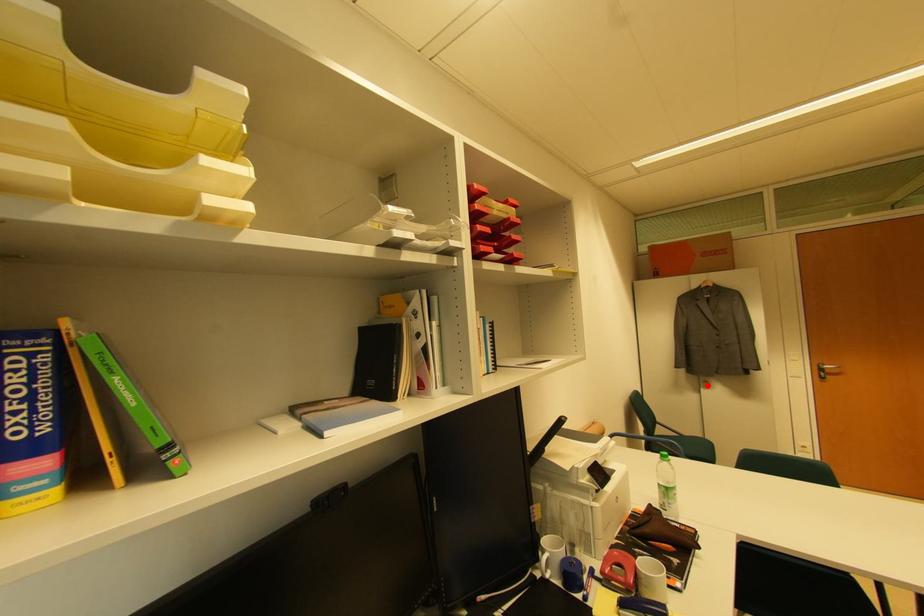
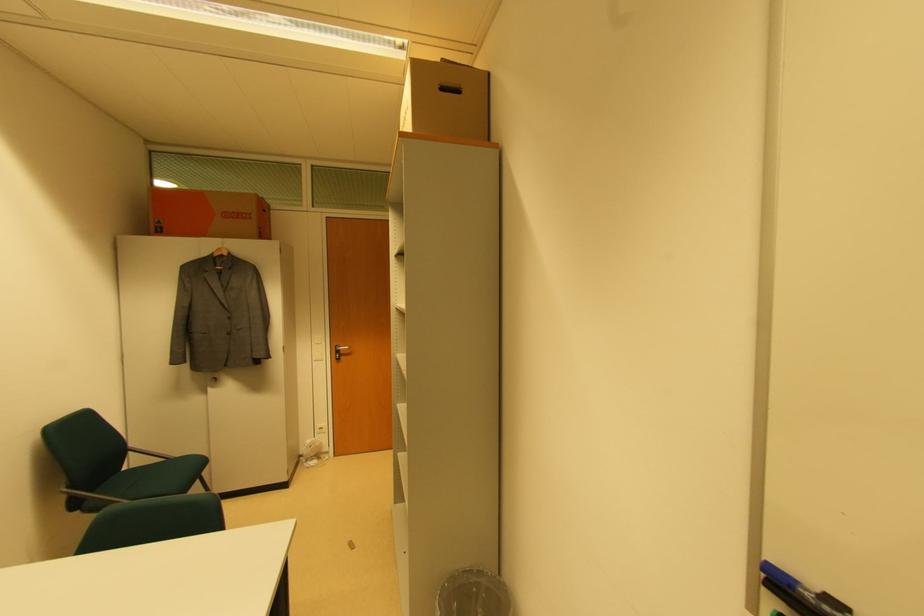
Find the pixel in the second image that matches the highlighted location in the first image.

(216, 382)